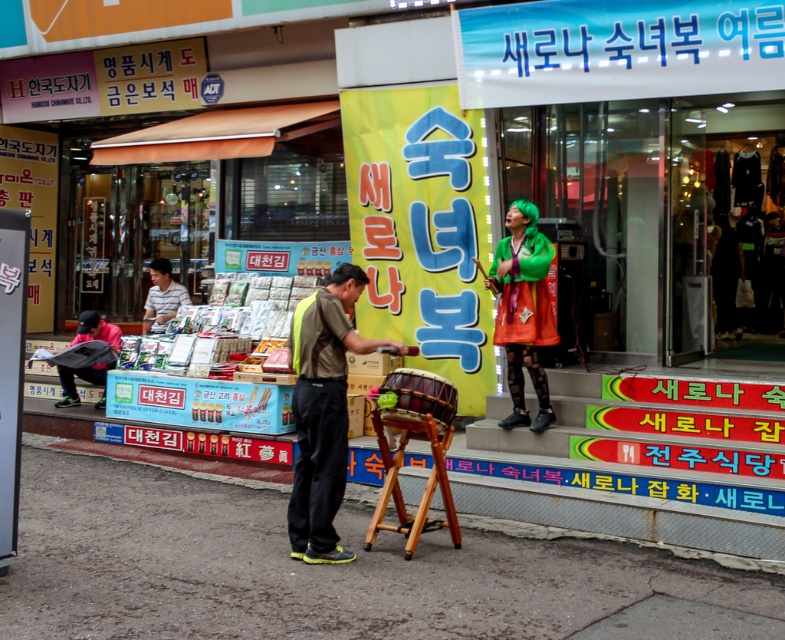
You are a photographer trying to capture both the green felt hat at upper center and the matte black jacket at left in a single frame. Given their sizes, which object would you need to position closer to the camera to ensure both appear similarly sized in the photo?

The green felt hat at upper center has a smaller size compared to matte black jacket at left. To make both appear similarly sized in the photo, you should position the green felt hat at upper center closer to the camera since it is smaller and needs to be enlarged in the frame.

You are a delivery person who needs to place a package on the ground. The package is as wide as the striped shirt at center. Will the concrete pavement at lower center be wide enough to hold the package?

The concrete pavement at lower center is wider than the striped shirt at center, so yes, the concrete pavement at lower center can accommodate the package since its width exceeds the package size.